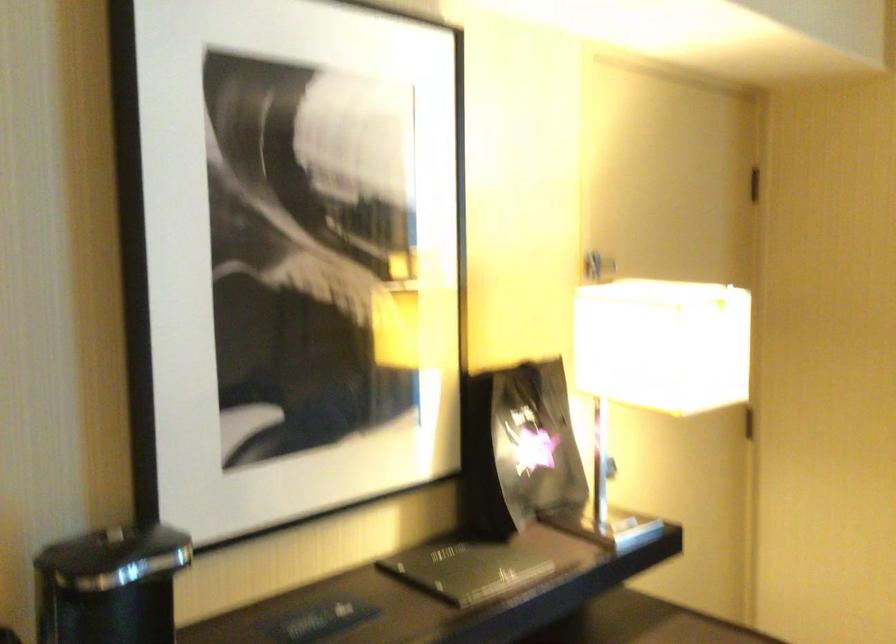
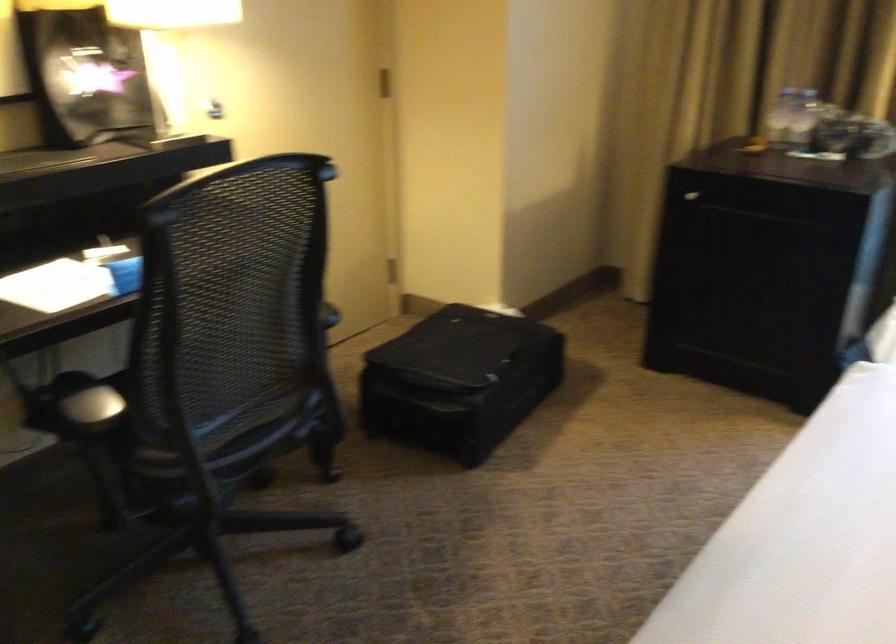
Which direction would the cameraman need to move to produce the second image?

The movement direction of the cameraman is right, backward.